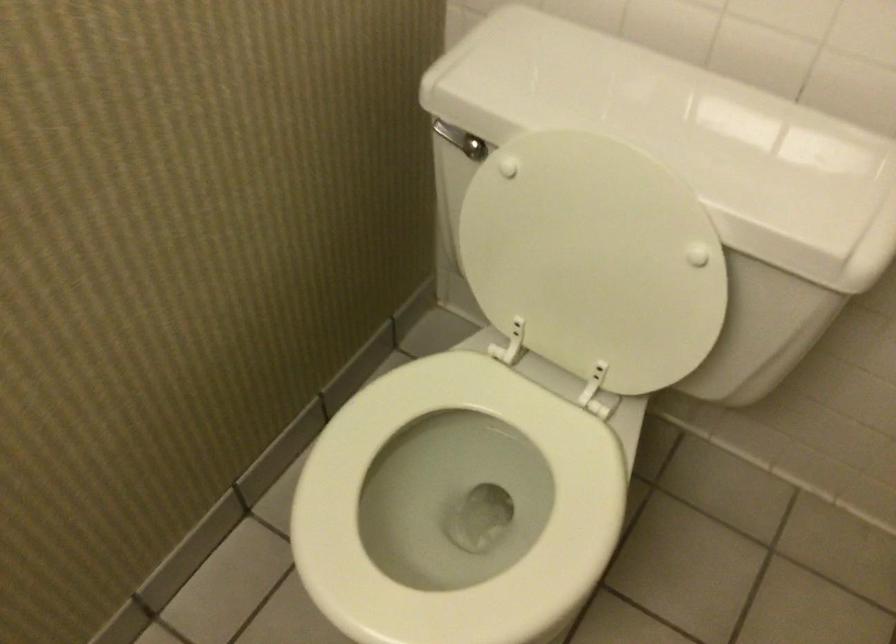
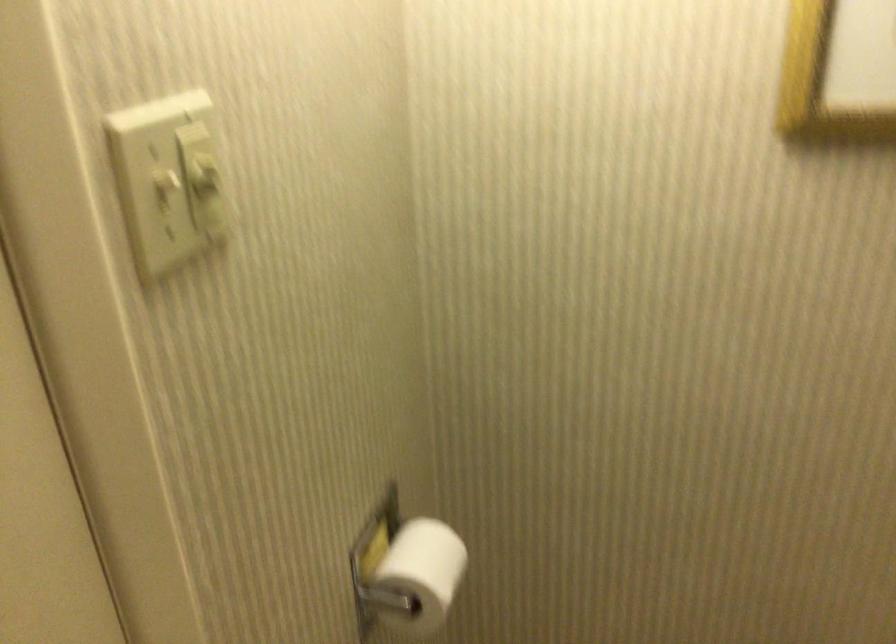
Question: Based on the continuous images, in which direction is the camera rotating? Reply with the corresponding letter.

Choices:
 (A) Left
 (B) Right
 (C) Up
 (D) Down

Answer: (A)